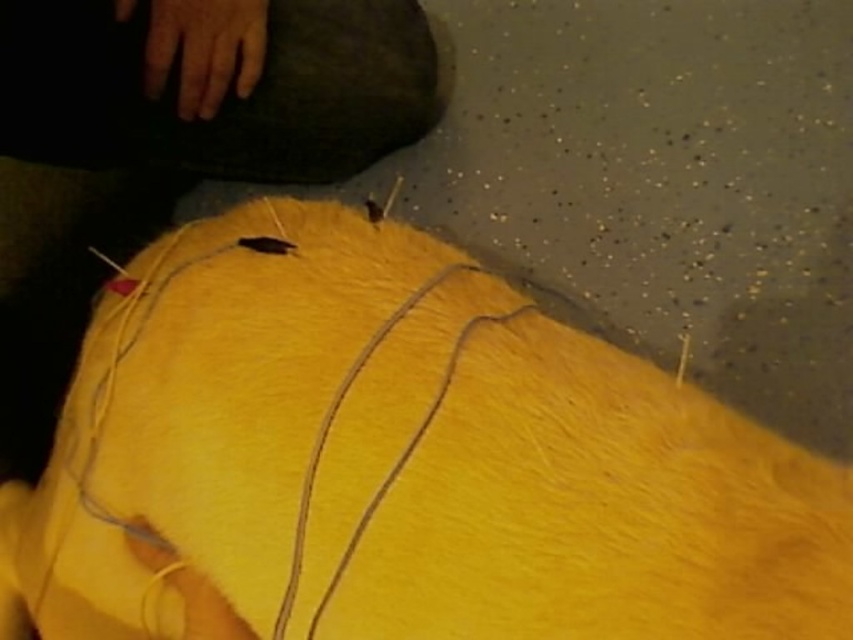
Question: Does yellow fabric at center lie in front of yellow fabric string at center?

Choices:
 (A) yes
 (B) no

Answer: (A)

Question: Which object appears closest to the camera in this image?

Choices:
 (A) yellow fabric string at center
 (B) yellow fabric at center

Answer: (B)

Question: Which point is farther to the camera?

Choices:
 (A) yellow fabric string at center
 (B) yellow fabric at center

Answer: (A)

Question: Can you confirm if yellow fabric at center is positioned above yellow fabric string at center?

Choices:
 (A) no
 (B) yes

Answer: (A)

Question: Considering the relative positions of yellow fabric at center and yellow fabric string at center in the image provided, where is yellow fabric at center located with respect to yellow fabric string at center?

Choices:
 (A) above
 (B) below

Answer: (B)